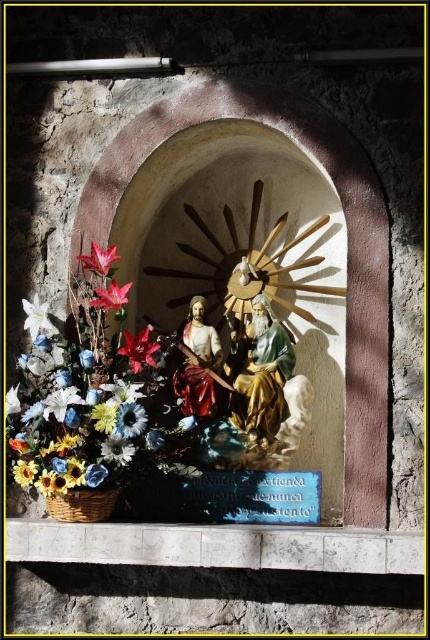
You are an artist planning to paint a detailed replica of the shrine scene. You need to ensure the sizes of the white matte flower at lower left and the matte sunflower at lower left are proportionally accurate. Which one should you paint smaller to maintain the correct proportions?

The white matte flower at lower left should be painted smaller because it occupies less space than the matte sunflower at lower left according to the description.

You are a visitor to the shrine and want to place a new decoration. You notice the multicolored artificial flowers at left and the yellow matte flower at center. Which decoration is closer to you as you face the shrine?

The multicolored artificial flowers at left is closer to you because it is in front of the yellow matte flower at center.

You are a gardener tasked with arranging flowers in a shrine. You have two flowers to place at the center of the shrine. The matte red flower at center and the white matte flower at center. Which flower should you choose if you want the one that takes up more space horizontally?

The matte red flower at center has a larger width than the white matte flower at center, so you should choose the matte red flower at center if you want the one that takes up more space horizontally.